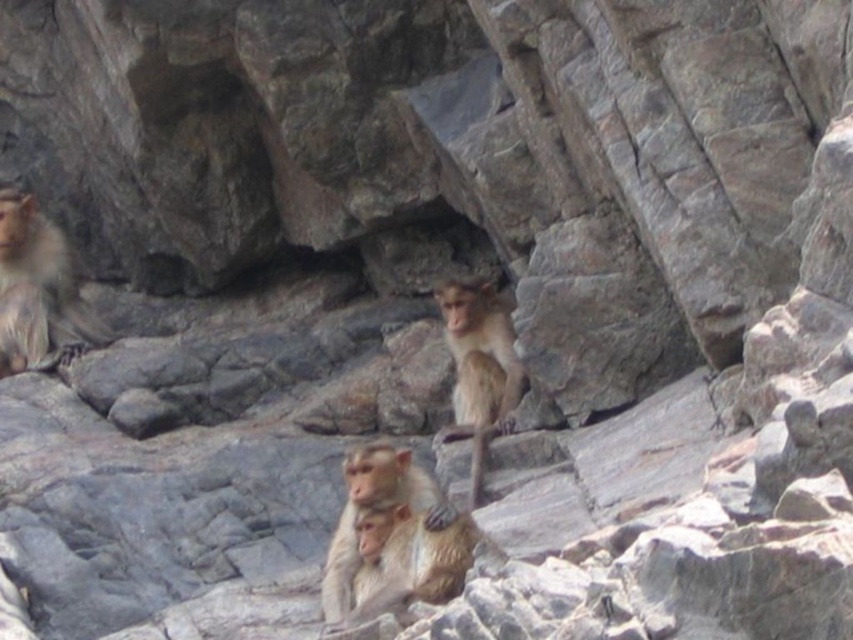
You are a wildlife photographer aiming to capture a closeup shot of the monkeys. You have a camera with a zoom lens that can focus on subjects up to 5 meters away. The golden fur monkey at upper left is 6 meters away from your current position, while the light brown fur monkey at center is 3 meters away. Can you take a closeup of both monkeys without moving your position?

The light brown fur monkey at center is within the camera range since it is 3 meters away, but the golden fur monkey at upper left is 6 meters away, which exceeds the camera lens limit. Therefore, you can only take a closeup of the light brown fur monkey at center.

You are standing in front of the rocky terrain where the monkeys are. There are two points marked on the rocks. The first point is at coordinates point (50,316) and the second is at point (463,390). Which point is closer to you?

Point (50,316) is closer to you because it is further to the viewer than point (463,390).